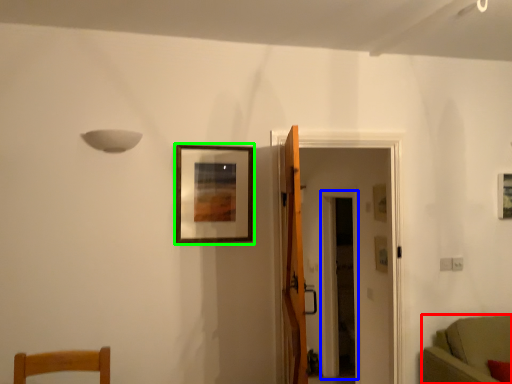
Question: Which object is the farthest from furniture (highlighted by a red box)? Choose among these: glass door (highlighted by a blue box) or picture frame (highlighted by a green box).

Choices:
 (A) glass door
 (B) picture frame

Answer: (A)